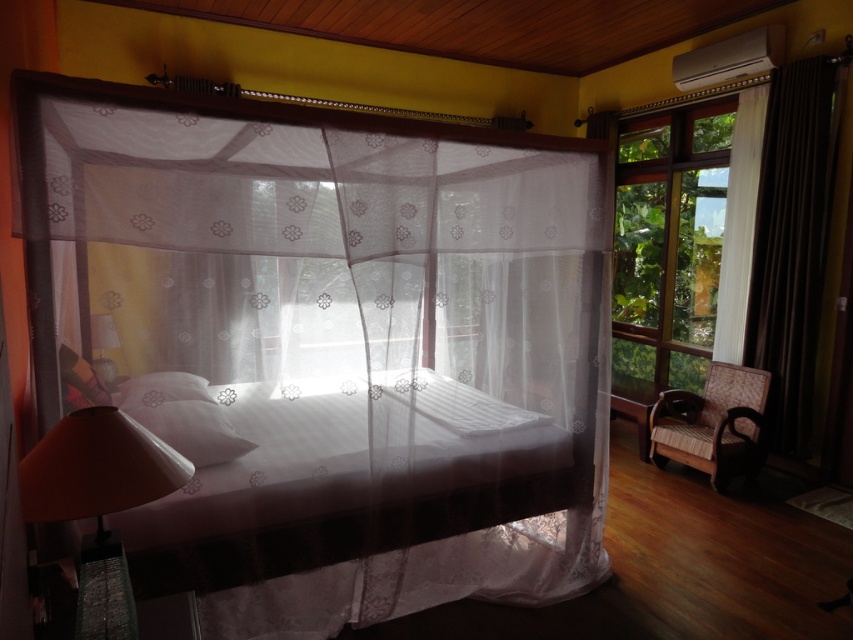
You are standing in the bedroom and want to let more natural light into the room. Which object, the transparent glass window at right or the white sheer curtain at right, should you adjust to achieve this goal?

The transparent glass window at right is larger in size than the white sheer curtain at right, so adjusting the transparent glass window at right would allow more natural light into the room since it has a bigger opening.

From the picture: You are standing in the bedroom and want to let more natural light into the room. Which object, the transparent glass window at right or the white soft pillow at center, should you move to achieve this?

The transparent glass window at right is bigger than the white soft pillow at center. To let more natural light in, you should move the white soft pillow at center away from the window so the larger window can admit more light.